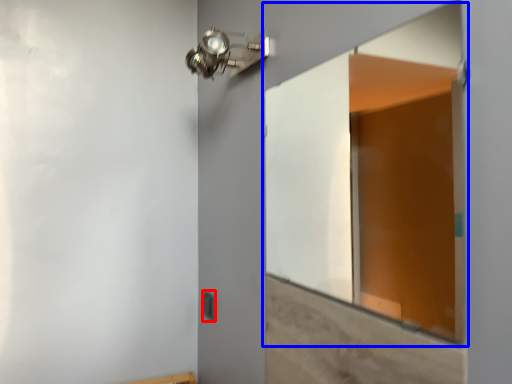
Question: Among these objects, which one is nearest to the camera, light switch (highlighted by a red box) or window (highlighted by a blue box)?

Choices:
 (A) light switch
 (B) window

Answer: (B)